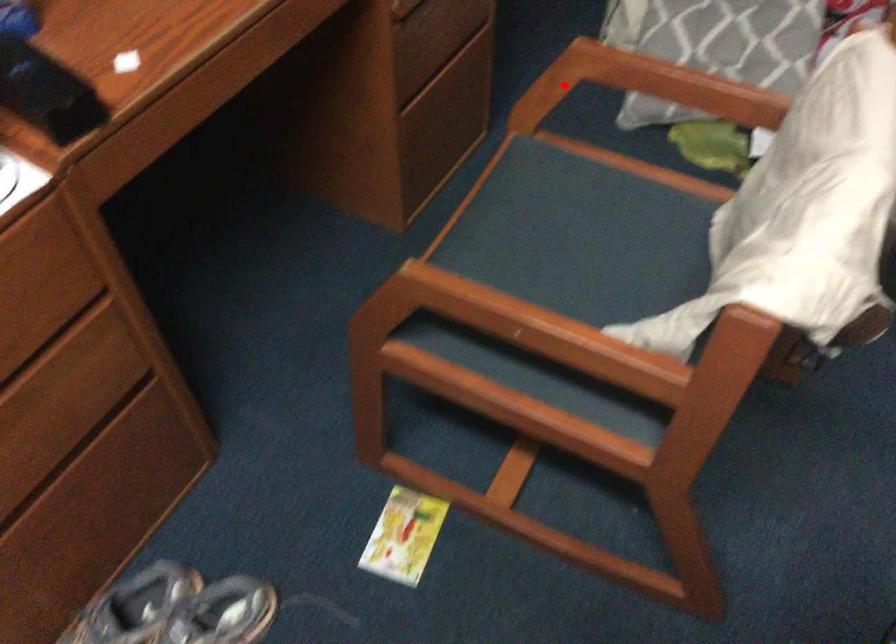
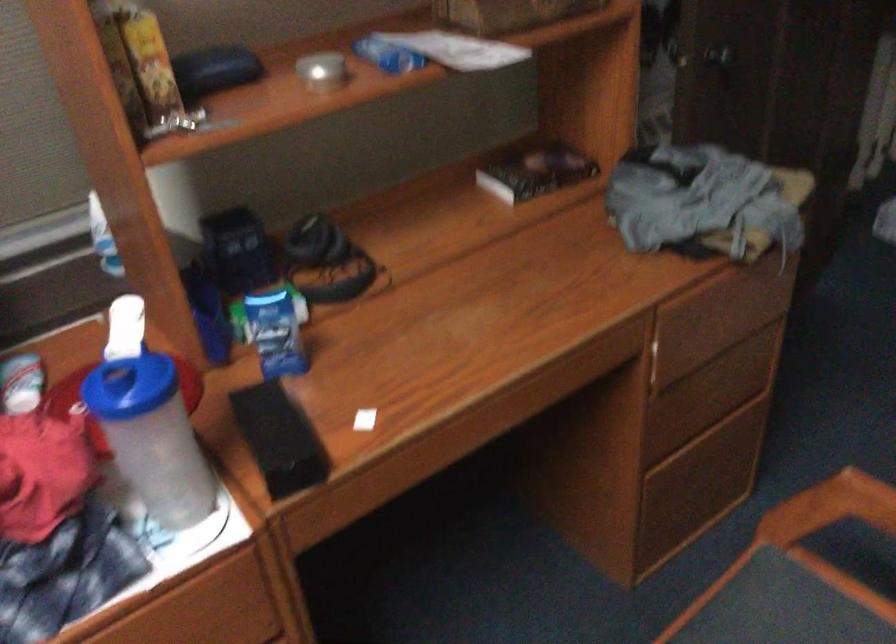
Locate, in the second image, the point that corresponds to the highlighted location in the first image.

(830, 507)